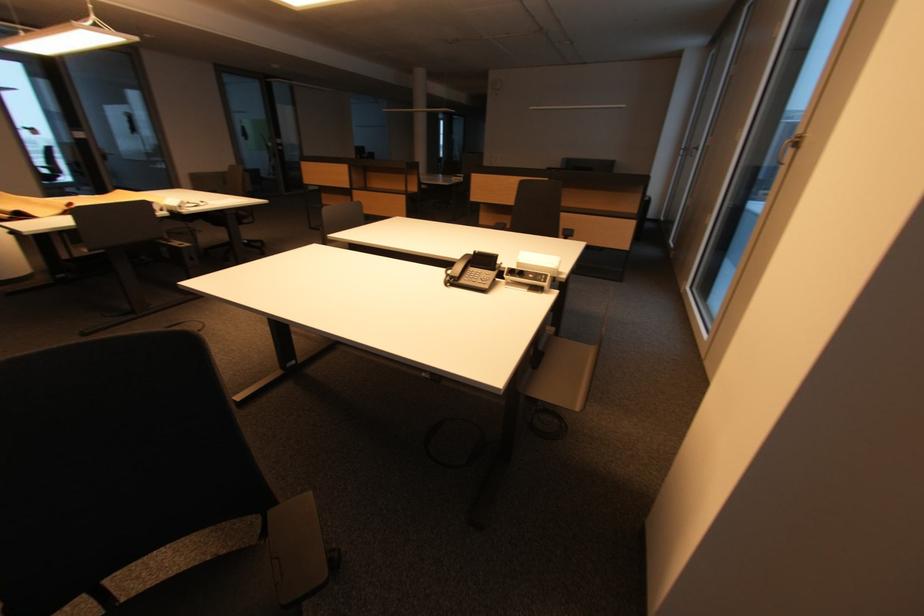
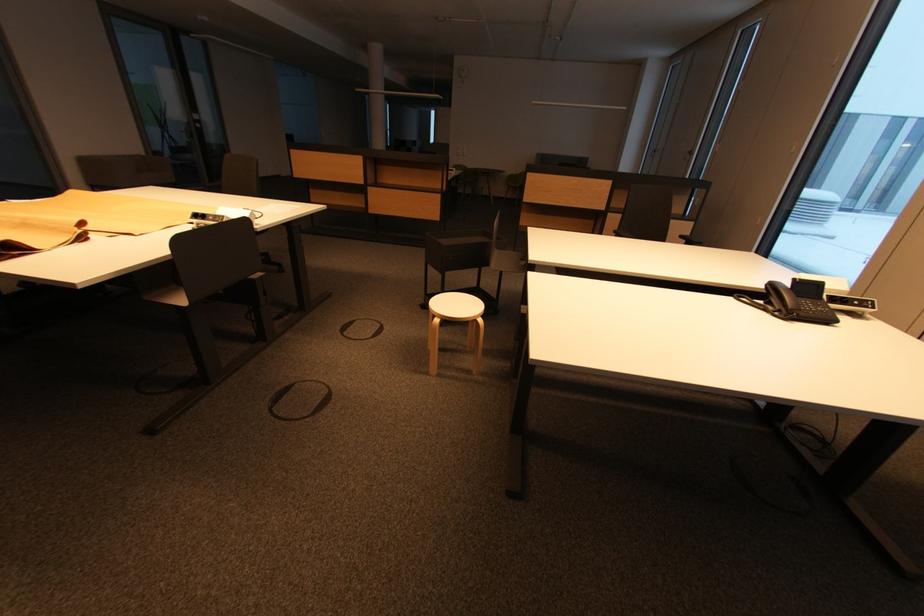
Question: The images are taken continuously from a first-person perspective. In which direction are you moving?

Choices:
 (A) Left
 (B) Right
 (C) Forward
 (D) Backward

Answer: (A)